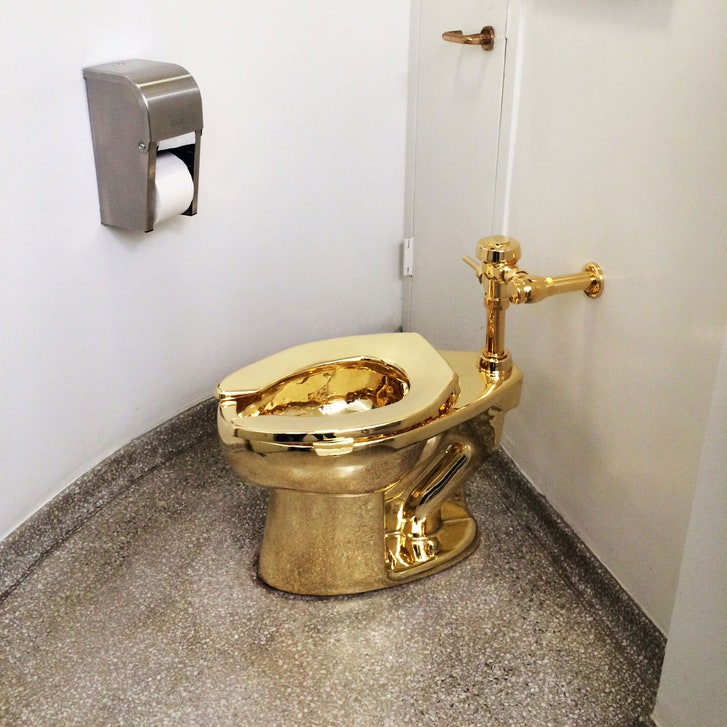
Locate an element on the screen. handle is located at coordinates (473, 41).